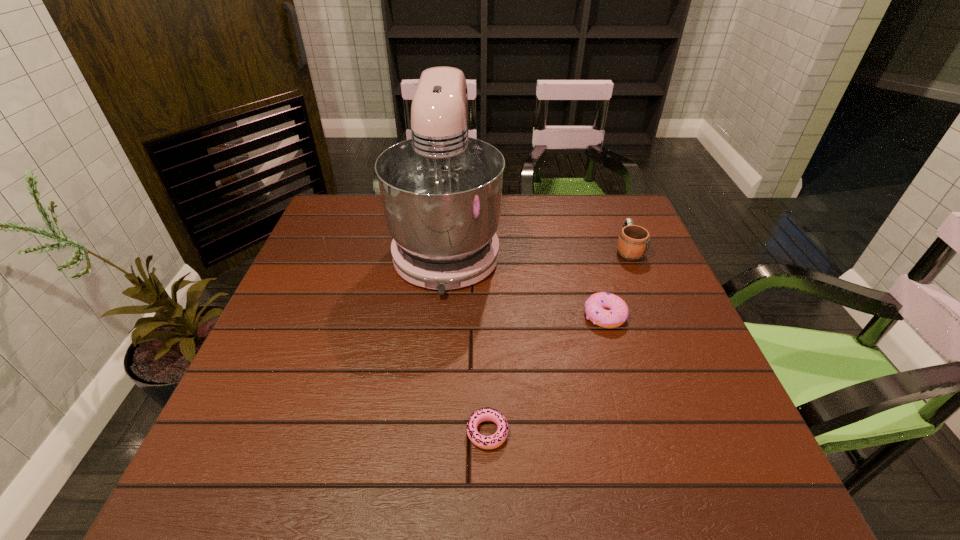
The width and height of the screenshot is (960, 540). Identify the location of mixer. (441, 191).

Where is `the rightmost object`? the rightmost object is located at coordinates (633, 242).

Locate an element on the screen. Image resolution: width=960 pixels, height=540 pixels. the third shortest object is located at coordinates (633, 242).

This screenshot has width=960, height=540. I want to click on the third tallest object, so click(617, 312).

Find the location of `the third object from left to right`. the third object from left to right is located at coordinates (617, 312).

Find the location of a particular element. This screenshot has height=540, width=960. the shorter doughnut is located at coordinates (497, 439).

In order to click on the nearer doughnut in this screenshot , I will do `click(497, 439)`.

This screenshot has width=960, height=540. I want to click on vacant area located on the front-facing side of the tallest object, so click(x=430, y=427).

Identify the location of vacant space positioned on the side of the mug with the handle. This screenshot has height=540, width=960. [610, 205].

At what (x,y) coordinates should I click in order to perform the action: click on free region located 0.120m on the side of the mug with the handle. Please return your answer as a coordinate pair (x, y). Looking at the image, I should click on (613, 214).